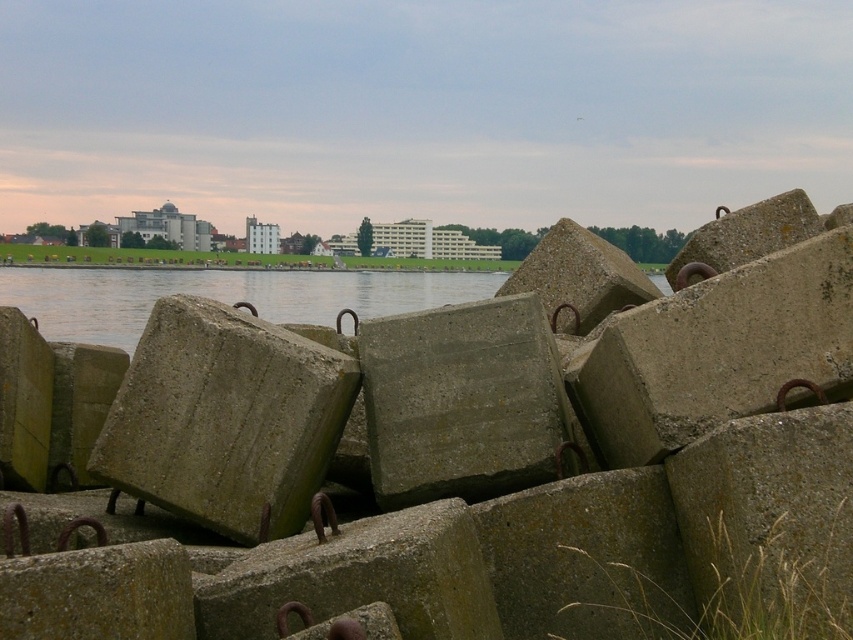
Who is lower down, gray concrete tetrapod at center or green concrete tetrapod at center?

Positioned lower is green concrete tetrapod at center.

Is the position of gray concrete tetrapod at center more distant than that of green concrete tetrapod at center?

That is False.

Between point (643, 616) and point (109, 410), which one is positioned behind?

Point (109, 410)

You are a GUI agent. You are given a task and a screenshot of the screen. Output one action in this format:
    pyautogui.click(x=<x>, y=<y>)
    Task: Click on the gray concrete tetrapod at center
    
    Given the screenshot: What is the action you would take?
    pyautogui.click(x=454, y=456)